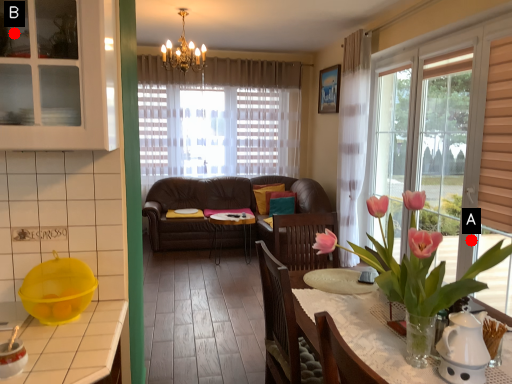
Question: Two points are circled on the image, labeled by A and B beside each circle. Among these points, which one is nearest to the camera?

Choices:
 (A) A is closer
 (B) B is closer

Answer: (B)